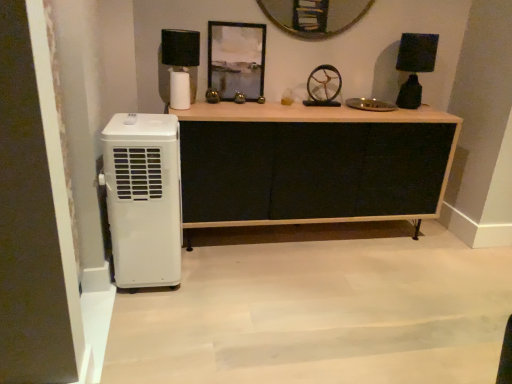
Question: Does metallic silver frame at upper center come in front of black matte lampshade at upper left, the first lamp in the left-to-right sequence?

Choices:
 (A) yes
 (B) no

Answer: (B)

Question: Considering the relative positions of metallic silver frame at upper center and black matte lampshade at upper left, which appears as the second lamp when viewed from the right, in the image provided, is metallic silver frame at upper center to the left of black matte lampshade at upper left, which appears as the second lamp when viewed from the right, from the viewer's perspective?

Choices:
 (A) yes
 (B) no

Answer: (B)

Question: Does metallic silver frame at upper center have a smaller size compared to black matte lampshade at upper left, which appears as the second lamp when viewed from the right?

Choices:
 (A) no
 (B) yes

Answer: (B)

Question: Does metallic silver frame at upper center have a lesser width compared to black matte lampshade at upper left, which appears as the second lamp when viewed from the right?

Choices:
 (A) yes
 (B) no

Answer: (A)

Question: Is metallic silver frame at upper center taller than black matte lampshade at upper left, the first lamp in the left-to-right sequence?

Choices:
 (A) yes
 (B) no

Answer: (A)

Question: Does metallic silver frame at upper center touch black matte lampshade at upper left, which appears as the second lamp when viewed from the right?

Choices:
 (A) no
 (B) yes

Answer: (A)

Question: Is the surface of black fabric cabinet at center in direct contact with white plastic air conditioner at left?

Choices:
 (A) yes
 (B) no

Answer: (B)

Question: Is black fabric cabinet at center closer to the viewer compared to white plastic air conditioner at left?

Choices:
 (A) no
 (B) yes

Answer: (A)

Question: From a real-world perspective, is black fabric cabinet at center positioned under white plastic air conditioner at left based on gravity?

Choices:
 (A) yes
 (B) no

Answer: (A)

Question: From the image's perspective, would you say black fabric cabinet at center is shown under white plastic air conditioner at left?

Choices:
 (A) no
 (B) yes

Answer: (A)

Question: Considering the relative sizes of black fabric cabinet at center and white plastic air conditioner at left in the image provided, is black fabric cabinet at center shorter than white plastic air conditioner at left?

Choices:
 (A) yes
 (B) no

Answer: (A)

Question: Is black fabric cabinet at center located outside white plastic air conditioner at left?

Choices:
 (A) yes
 (B) no

Answer: (A)

Question: Is metallic gold wheel at center smaller than black fabric cabinet at center?

Choices:
 (A) yes
 (B) no

Answer: (A)